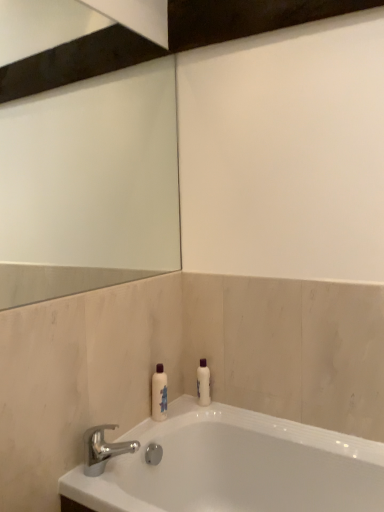
Question: Is silver metallic faucet at lower left bigger than white glossy bottle at center?

Choices:
 (A) yes
 (B) no

Answer: (A)

Question: Can you confirm if silver metallic faucet at lower left is smaller than white glossy bottle at center?

Choices:
 (A) yes
 (B) no

Answer: (B)

Question: Considering the relative positions of silver metallic faucet at lower left and white glossy bottle at center in the image provided, is silver metallic faucet at lower left behind white glossy bottle at center?

Choices:
 (A) yes
 (B) no

Answer: (B)

Question: From the image's perspective, would you say silver metallic faucet at lower left is positioned over white glossy bottle at center?

Choices:
 (A) no
 (B) yes

Answer: (A)

Question: Is silver metallic faucet at lower left looking in the opposite direction of white glossy bottle at center?

Choices:
 (A) no
 (B) yes

Answer: (A)

Question: Does silver metallic faucet at lower left have a greater height compared to white glossy bottle at center?

Choices:
 (A) no
 (B) yes

Answer: (A)

Question: Considering the relative positions of silver metallic faucet at lower left and white glossy bathtub at lower center in the image provided, is silver metallic faucet at lower left behind white glossy bathtub at lower center?

Choices:
 (A) yes
 (B) no

Answer: (A)

Question: Considering the relative sizes of silver metallic faucet at lower left and white glossy bathtub at lower center in the image provided, is silver metallic faucet at lower left thinner than white glossy bathtub at lower center?

Choices:
 (A) no
 (B) yes

Answer: (B)

Question: Is silver metallic faucet at lower left completely or partially outside of white glossy bathtub at lower center?

Choices:
 (A) no
 (B) yes

Answer: (B)

Question: Does silver metallic faucet at lower left have a greater height compared to white glossy bathtub at lower center?

Choices:
 (A) no
 (B) yes

Answer: (A)

Question: Considering the relative sizes of silver metallic faucet at lower left and white glossy bathtub at lower center in the image provided, is silver metallic faucet at lower left shorter than white glossy bathtub at lower center?

Choices:
 (A) yes
 (B) no

Answer: (A)

Question: Would you say silver metallic faucet at lower left contains white glossy bathtub at lower center?

Choices:
 (A) no
 (B) yes

Answer: (A)

Question: Is white glossy bottle at center far away from white glossy bathtub at lower center?

Choices:
 (A) yes
 (B) no

Answer: (B)